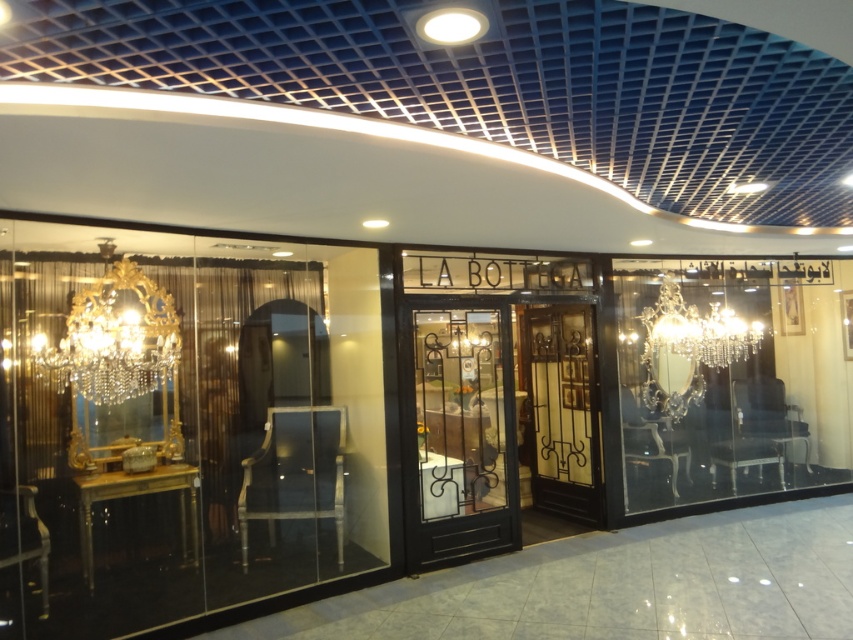
Question: Is gold crystal chandelier at left thinner than clear crystal chandelier at center?

Choices:
 (A) yes
 (B) no

Answer: (A)

Question: Can you confirm if black wrought iron door at center is thinner than gold crystal chandelier at left?

Choices:
 (A) no
 (B) yes

Answer: (B)

Question: Can you confirm if black wrought iron door at center is positioned below clear crystal chandelier at center?

Choices:
 (A) no
 (B) yes

Answer: (B)

Question: Which is nearer to the black wrought iron door at center?

Choices:
 (A) clear crystal chandelier at center
 (B) gold crystal chandelier at left

Answer: (B)

Question: Which is nearer to the black wrought iron door at center?

Choices:
 (A) gold crystal chandelier at left
 (B) clear crystal chandelier at center

Answer: (A)

Question: Which point appears farthest from the camera in this image?

Choices:
 (A) (91, 362)
 (B) (694, 360)
 (C) (437, 337)

Answer: (B)